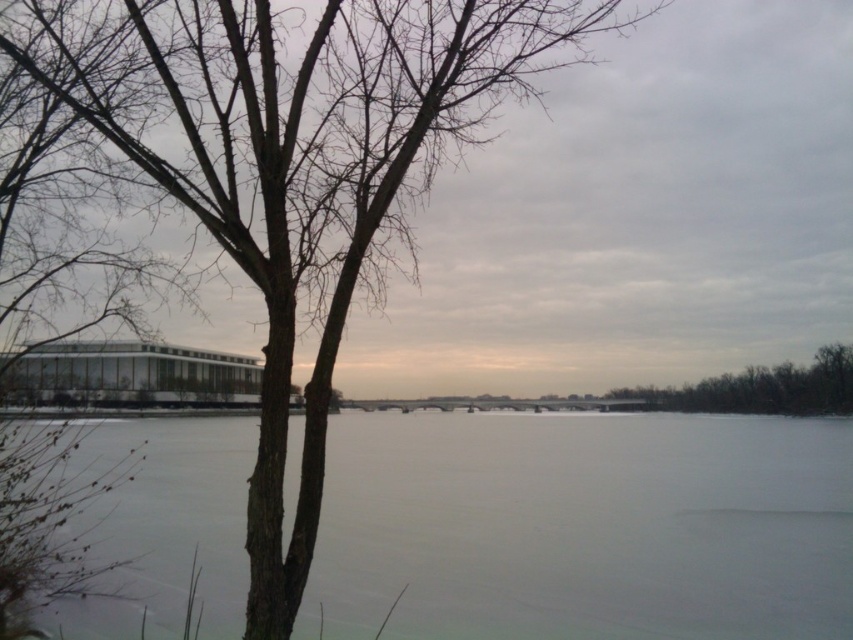
Is white ice at center to the right of brown bark tree at right from the viewer's perspective?

Incorrect, white ice at center is not on the right side of brown bark tree at right.

Can you confirm if white ice at center is bigger than brown bark tree at right?

Incorrect, white ice at center is not larger than brown bark tree at right.

Which is behind, point (376, 621) or point (811, 372)?

Point (811, 372)

What are the coordinates of `white ice at center` in the screenshot? It's located at (584, 528).